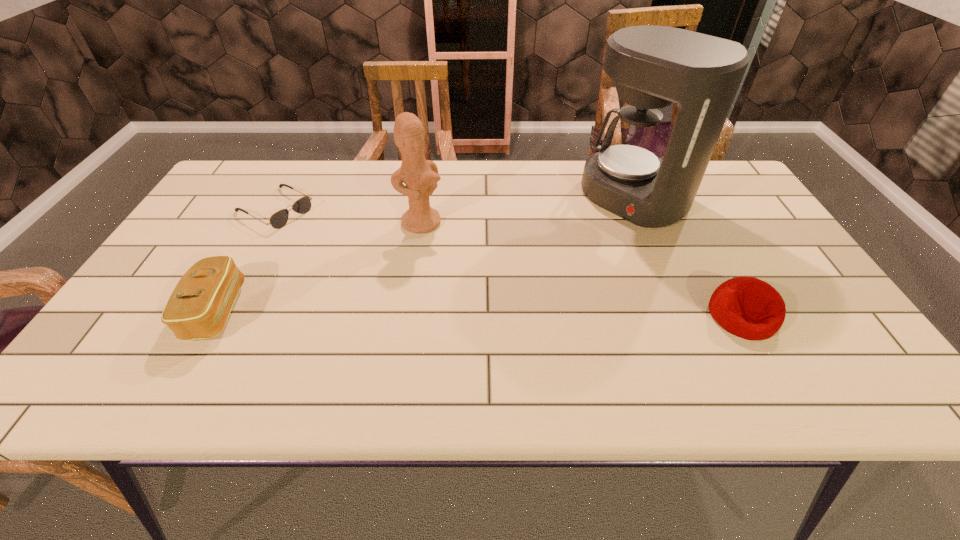
Where is `vacant region between the clutch bag and the beanbag`? The height and width of the screenshot is (540, 960). vacant region between the clutch bag and the beanbag is located at coordinates (479, 313).

At what (x,y) coordinates should I click in order to perform the action: click on empty space that is in between the shortest object and the third object from right to left. Please return your answer as a coordinate pair (x, y). Looking at the image, I should click on (348, 217).

Point out which object is positioned as the nearest to the beanbag. Please provide its 2D coordinates. Your answer should be formatted as a tuple, i.e. [(x, y)], where the tuple contains the x and y coordinates of a point satisfying the conditions above.

[(653, 66)]

Identify which object is the second nearest to the figurine. Please provide its 2D coordinates. Your answer should be formatted as a tuple, i.e. [(x, y)], where the tuple contains the x and y coordinates of a point satisfying the conditions above.

[(198, 308)]

At what (x,y) coordinates should I click in order to perform the action: click on free location that satisfies the following two spatial constraints: 1. on the front side of the shortest object; 2. on the right side of the third object from right to left. Please return your answer as a coordinate pair (x, y). Looking at the image, I should click on (268, 224).